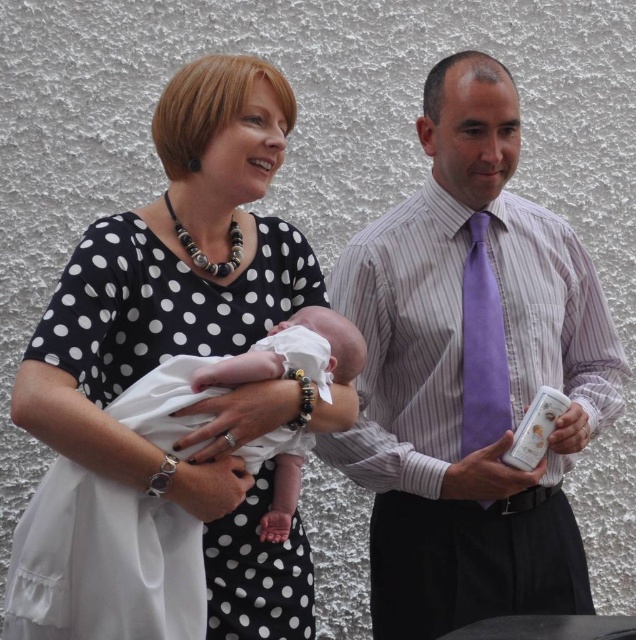
You are a photographer taking a photo of the scene. You notice a point at coordinates [287,353]. What is this point located on?

The point at coordinates [287,353] is located on the white soft cloth at center.

You are a photographer setting up for a family photo. You notice the purple striped shirt at center and the white soft cloth at center in the scene. Which object should you focus on first if you want to capture the taller object in your frame?

The purple striped shirt at center is taller than the white soft cloth at center, so you should focus on the purple striped shirt at center first to capture the taller object in your frame.

You are a photographer setting up for a family photo. You notice the purple striped shirt at center and the white soft cloth at center in the scene. Which item has a greater width when viewed from your position?

The purple striped shirt at center has a greater width than the white soft cloth at center.